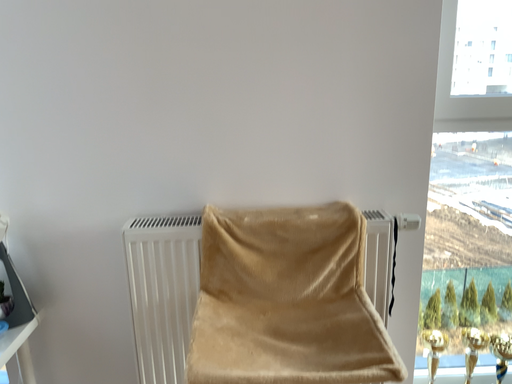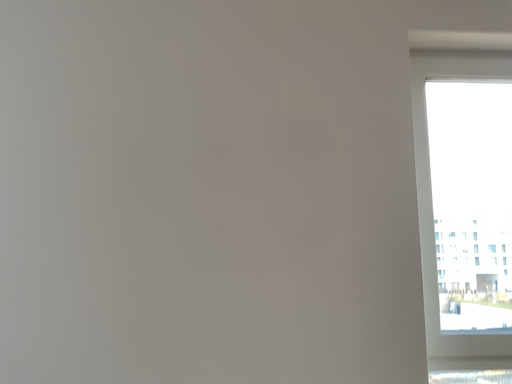
Question: Which way did the camera rotate in the video?

Choices:
 (A) rotated downward
 (B) rotated upward

Answer: (B)